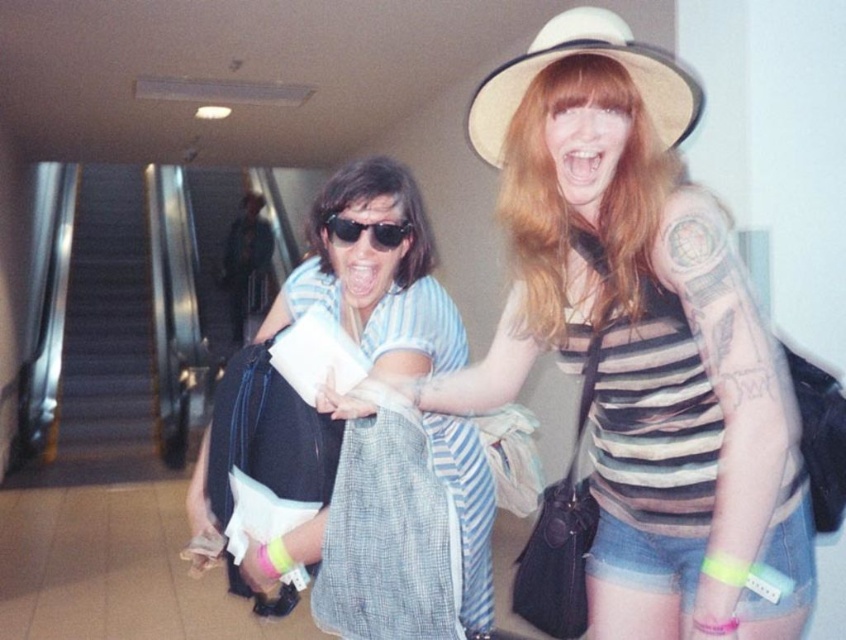
How distant is striped fabric shirt at center from matte black sunglasses at center?

striped fabric shirt at center and matte black sunglasses at center are 21.24 inches apart.

What do you see at coordinates (640, 337) in the screenshot? The height and width of the screenshot is (640, 846). I see `striped fabric shirt at center` at bounding box center [640, 337].

Locate an element on the screen. The height and width of the screenshot is (640, 846). striped fabric shirt at center is located at coordinates (640, 337).

From the picture: Between blue striped shirt at center and black metal escalator at left, which one is positioned higher?

Positioned higher is black metal escalator at left.

Is blue striped shirt at center thinner than black metal escalator at left?

No, blue striped shirt at center is not thinner than black metal escalator at left.

The width and height of the screenshot is (846, 640). Describe the element at coordinates (394, 531) in the screenshot. I see `blue striped shirt at center` at that location.

Where is `blue striped shirt at center`? The image size is (846, 640). blue striped shirt at center is located at coordinates (394, 531).

Consider the image. Between striped fabric shirt at center and blue striped shirt at center, which one appears on the left side from the viewer's perspective?

From the viewer's perspective, blue striped shirt at center appears more on the left side.

Which is behind, point (558, 16) or point (198, 483)?

The point (558, 16) is behind.

What do you see at coordinates (640, 337) in the screenshot? I see `striped fabric shirt at center` at bounding box center [640, 337].

Locate an element on the screen. striped fabric shirt at center is located at coordinates (640, 337).